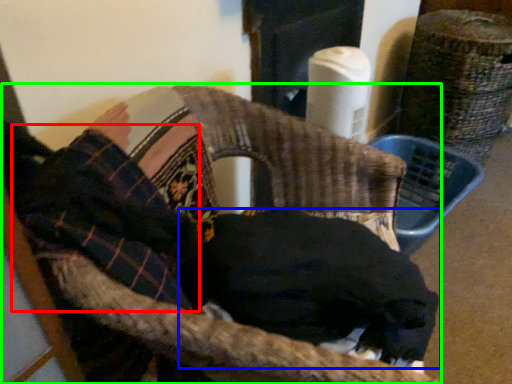
Question: Estimate the real-world distances between objects in this image. Which object is closer to clothing (highlighted by a red box), dog (highlighted by a blue box) or chair (highlighted by a green box)?

Choices:
 (A) dog
 (B) chair

Answer: (B)